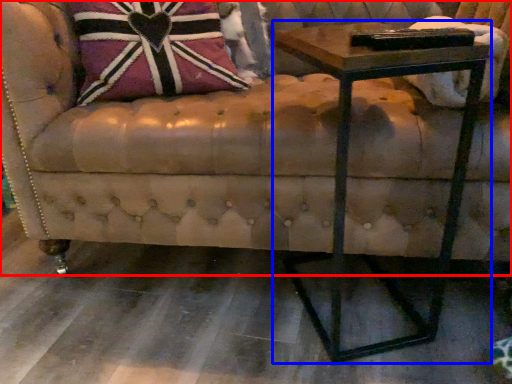
Question: Among these objects, which one is nearest to the camera, studio couch (highlighted by a red box) or table (highlighted by a blue box)?

Choices:
 (A) studio couch
 (B) table

Answer: (B)